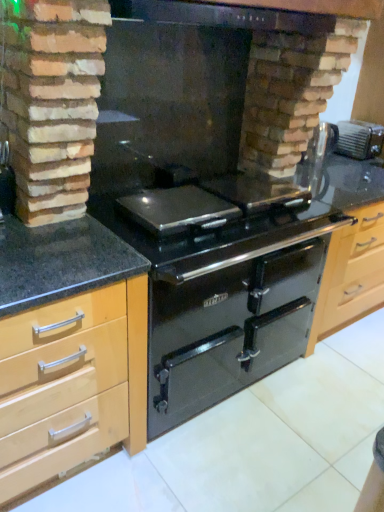
Image resolution: width=384 pixels, height=512 pixels. What do you see at coordinates (359, 139) in the screenshot?
I see `metallic silver toaster at upper right` at bounding box center [359, 139].

This screenshot has width=384, height=512. What do you see at coordinates (222, 16) in the screenshot?
I see `black glass exhaust hood at upper center` at bounding box center [222, 16].

Describe the element at coordinates (60, 262) in the screenshot. This screenshot has width=384, height=512. I see `black granite countertop at center` at that location.

This screenshot has height=512, width=384. In order to click on black glass fireplace at center in this screenshot , I will do `click(210, 91)`.

Would you say black granite countertop at center contains black glass exhaust hood at upper center?

That's incorrect, black glass exhaust hood at upper center is not inside black granite countertop at center.

In terms of height, does black granite countertop at center look taller or shorter compared to black glass exhaust hood at upper center?

Clearly, black granite countertop at center is taller compared to black glass exhaust hood at upper center.

Is black granite countertop at center aimed at black glass exhaust hood at upper center?

No, black granite countertop at center is not turned towards black glass exhaust hood at upper center.

Visually, is black granite countertop at center positioned to the left or to the right of black glass exhaust hood at upper center?

In the image, black granite countertop at center appears on the right side of black glass exhaust hood at upper center.

In the image, is glossy black oven at center on the left side or the right side of black granite countertop at center?

Clearly, glossy black oven at center is on the left of black granite countertop at center in the image.

Is glossy black oven at center surrounding black granite countertop at center?

No, black granite countertop at center is not surrounded by glossy black oven at center.

Which is behind, point (295, 276) or point (58, 257)?

Positioned behind is point (295, 276).

How far apart are glossy black oven at center and black granite countertop at center?

glossy black oven at center and black granite countertop at center are 23.96 inches apart.

Considering the sizes of black glass exhaust hood at upper center and glossy black oven at center in the image, is black glass exhaust hood at upper center bigger or smaller than glossy black oven at center?

In the image, black glass exhaust hood at upper center appears to be smaller than glossy black oven at center.

Which object is closer to the camera, black glass exhaust hood at upper center or glossy black oven at center?

Positioned in front is black glass exhaust hood at upper center.

From the image's perspective, is black glass exhaust hood at upper center on top of glossy black oven at center?

Yes, from the image's perspective, black glass exhaust hood at upper center is over glossy black oven at center.

Are black glass exhaust hood at upper center and glossy black oven at center far apart?

Yes, black glass exhaust hood at upper center and glossy black oven at center are located far from each other.

Can you confirm if black granite countertop at center is wider than glossy black oven at center?

Correct, the width of black granite countertop at center exceeds that of glossy black oven at center.

Does black granite countertop at center lie behind glossy black oven at center?

No, black granite countertop at center is in front of glossy black oven at center.

From the image's perspective, does black granite countertop at center appear lower than glossy black oven at center?

Actually, black granite countertop at center appears above glossy black oven at center in the image.

Considering the relative positions of metallic silver toaster at upper right and black glass fireplace at center in the image provided, is metallic silver toaster at upper right to the left of black glass fireplace at center from the viewer's perspective?

In fact, metallic silver toaster at upper right is to the right of black glass fireplace at center.

Is black glass fireplace at center at the back of metallic silver toaster at upper right?

metallic silver toaster at upper right does not have its back to black glass fireplace at center.

From their relative heights in the image, would you say metallic silver toaster at upper right is taller or shorter than black glass fireplace at center?

In the image, metallic silver toaster at upper right appears to be shorter than black glass fireplace at center.

Is metallic silver toaster at upper right next to black glass fireplace at center and touching it?

No, metallic silver toaster at upper right is not making contact with black glass fireplace at center.

Is metallic silver toaster at upper right next to light wood/wooden cabinet at left and touching it?

There is a gap between metallic silver toaster at upper right and light wood/wooden cabinet at left.

From a real-world perspective, which object stands above the other?

metallic silver toaster at upper right is physically above.

From the picture: Is metallic silver toaster at upper right aimed at light wood/wooden cabinet at left?

No, metallic silver toaster at upper right is not turned towards light wood/wooden cabinet at left.

Is metallic silver toaster at upper right at the left side of glossy black oven at center?

Incorrect, metallic silver toaster at upper right is not on the left side of glossy black oven at center.

Are metallic silver toaster at upper right and glossy black oven at center far apart?

Yes, metallic silver toaster at upper right is far from glossy black oven at center.

Which of these two, metallic silver toaster at upper right or glossy black oven at center, stands taller?

glossy black oven at center.

Can you confirm if metallic silver toaster at upper right is smaller than glossy black oven at center?

Yes, metallic silver toaster at upper right is smaller than glossy black oven at center.

You are a GUI agent. You are given a task and a screenshot of the screen. Output one action in this format:
    pyautogui.click(x=<x>, y=<y>)
    Task: Click on the exhaust hood that is in front of the black granite countertop at center
    This screenshot has width=384, height=512.
    Given the screenshot: What is the action you would take?
    pyautogui.click(x=222, y=16)

Identify the location of oven directly beneath the black granite countertop at center (from a real-world perspective). point(228,330).

Which object lies further to the anchor point black granite countertop at center, black glass exhaust hood at upper center or light wood/wooden cabinet at left?

black glass exhaust hood at upper center lies further to black granite countertop at center than the other object.

Which object lies further to the anchor point black granite countertop at center, light wood/wooden cabinet at left or glossy black oven at center?

glossy black oven at center is further to black granite countertop at center.

Which object lies further to the anchor point metallic silver toaster at upper right, black glass fireplace at center or black granite countertop at center?

black granite countertop at center lies further to metallic silver toaster at upper right than the other object.

Considering their positions, is metallic silver toaster at upper right positioned closer to black glass exhaust hood at upper center than light wood/wooden cabinet at left?

The object closer to black glass exhaust hood at upper center is metallic silver toaster at upper right.

From the image, which object appears to be farther from light wood/wooden cabinet at left, black glass exhaust hood at upper center or black granite countertop at center?

black glass exhaust hood at upper center lies further to light wood/wooden cabinet at left than the other object.

When comparing their distances from glossy black oven at center, does black glass exhaust hood at upper center or black granite countertop at center seem closer?

black granite countertop at center is closer to glossy black oven at center.

Which object lies nearer to the anchor point glossy black oven at center, black glass exhaust hood at upper center or metallic silver toaster at upper right?

Based on the image, black glass exhaust hood at upper center appears to be nearer to glossy black oven at center.

When comparing their distances from black glass fireplace at center, does metallic silver toaster at upper right or black glass exhaust hood at upper center seem closer?

black glass exhaust hood at upper center is positioned closer to the anchor black glass fireplace at center.

Image resolution: width=384 pixels, height=512 pixels. Identify the location of oven between black glass exhaust hood at upper center and light wood/wooden cabinet at left from top to bottom. tap(228, 330).

I want to click on oven between light wood/wooden cabinet at left and black granite countertop at center, so click(228, 330).

Where is `counter top between light wood/wooden cabinet at left and metallic silver toaster at upper right along the z-axis`? counter top between light wood/wooden cabinet at left and metallic silver toaster at upper right along the z-axis is located at coordinates (60, 262).

You are a GUI agent. You are given a task and a screenshot of the screen. Output one action in this format:
    pyautogui.click(x=<x>, y=<y>)
    Task: Click on the oven between black granite countertop at center and metallic silver toaster at upper right from front to back
    The image size is (384, 512).
    Given the screenshot: What is the action you would take?
    pyautogui.click(x=228, y=330)